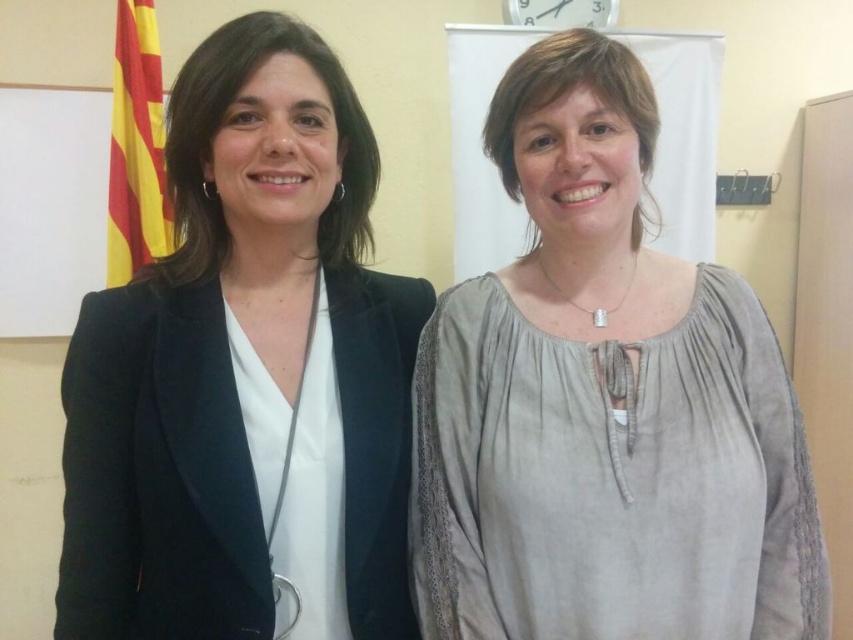
Question: Is the position of matte black blazer at left more distant than that of yellowmaterial/textureflag at left?

Choices:
 (A) no
 (B) yes

Answer: (A)

Question: Is light gray cotton blouse at center to the left of yellowmaterial/textureflag at left from the viewer's perspective?

Choices:
 (A) yes
 (B) no

Answer: (B)

Question: Which point appears farthest from the camera in this image?

Choices:
 (A) (109, 268)
 (B) (764, 490)
 (C) (378, 394)

Answer: (A)

Question: Which object is closer to the camera taking this photo?

Choices:
 (A) yellowmaterial/textureflag at left
 (B) light gray cotton blouse at center

Answer: (B)

Question: Which point appears closest to the camera in this image?

Choices:
 (A) tap(183, 493)
 (B) tap(762, 308)

Answer: (A)

Question: Is matte black blazer at left behind yellowmaterial/textureflag at left?

Choices:
 (A) no
 (B) yes

Answer: (A)